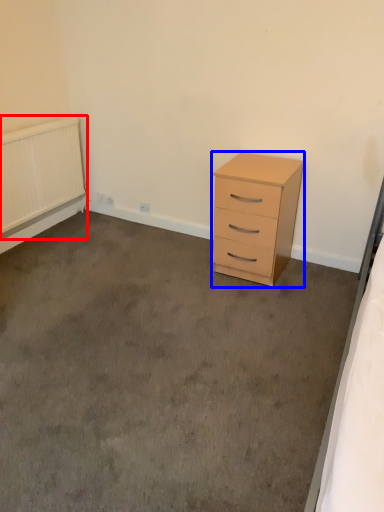
Question: Which object appears closest to the camera in this image, radiator (highlighted by a red box) or chest of drawers (highlighted by a blue box)?

Choices:
 (A) radiator
 (B) chest of drawers

Answer: (B)